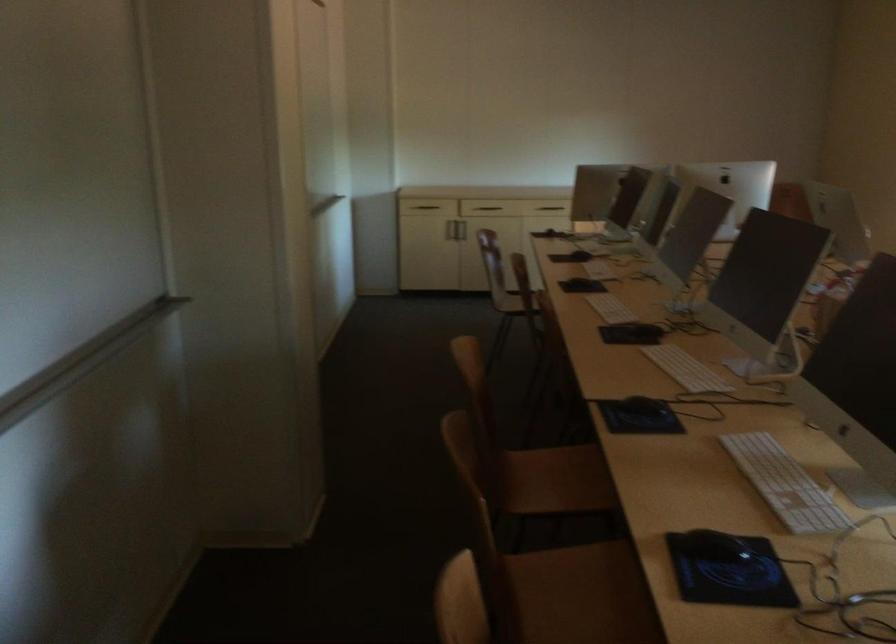
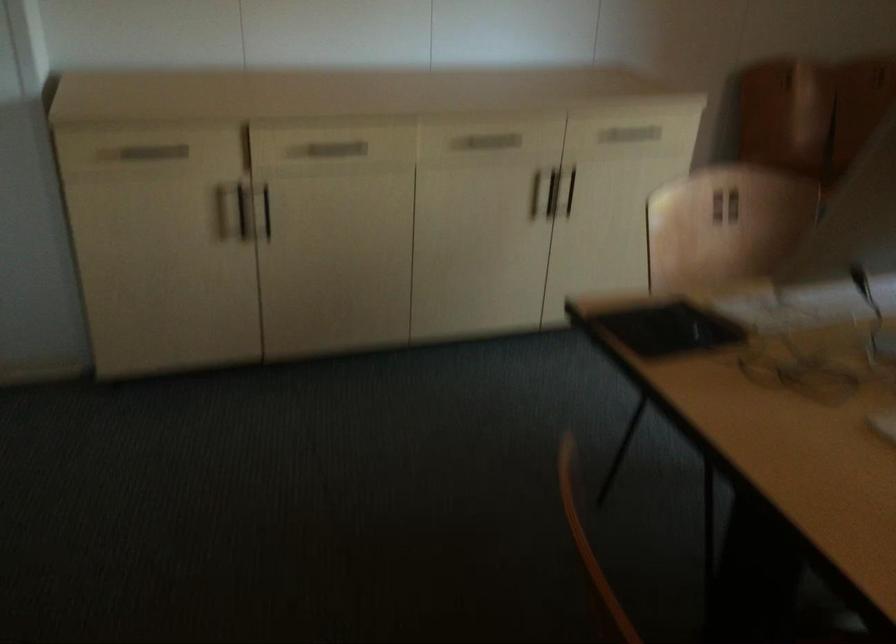
Question: Which direction would the cameraman need to move to produce the second image? Reply with the corresponding letter.

Choices:
 (A) Left
 (B) Right
 (C) Forward
 (D) Backward

Answer: (C)